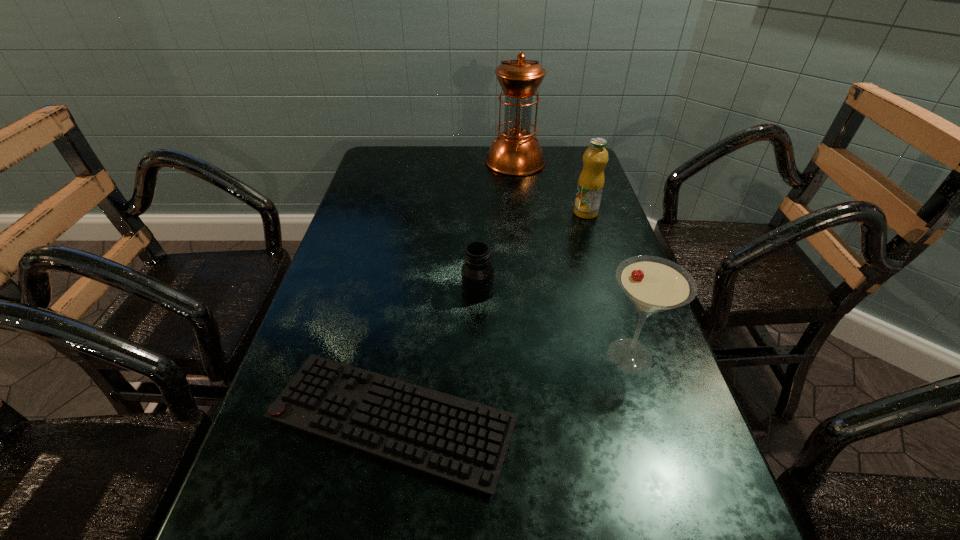
Where is `vacant space that satisfies the following two spatial constraints: 1. on the back side of the third farthest object; 2. on the right side of the oil lamp`? Image resolution: width=960 pixels, height=540 pixels. vacant space that satisfies the following two spatial constraints: 1. on the back side of the third farthest object; 2. on the right side of the oil lamp is located at coordinates (478, 161).